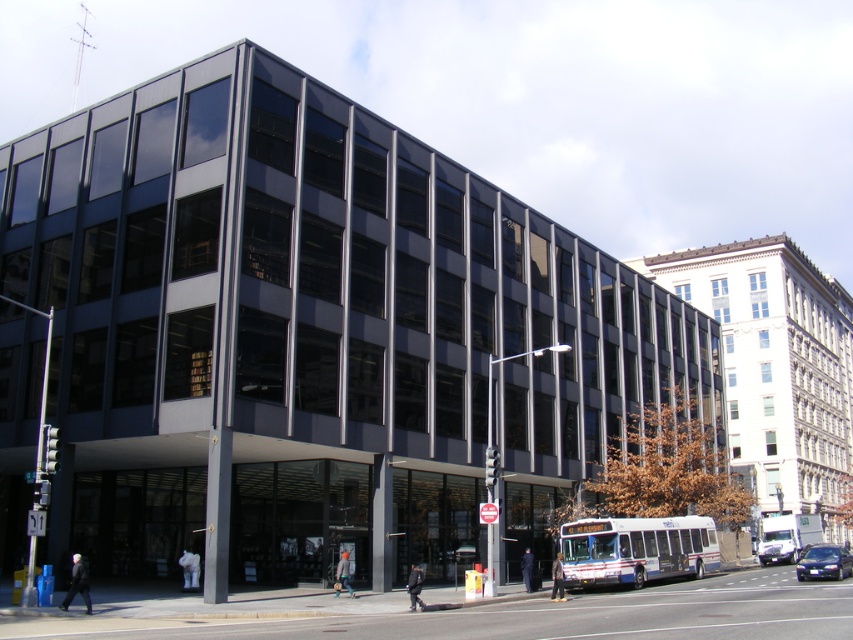
Can you confirm if white metallic bus at center is positioned above metallic blue sedan at center?

Yes, white metallic bus at center is above metallic blue sedan at center.

Locate an element on the screen. Image resolution: width=853 pixels, height=640 pixels. white metallic bus at center is located at coordinates (636, 548).

Does white matte bus at center have a greater width compared to metallic blue sedan at center?

Indeed, white matte bus at center has a greater width compared to metallic blue sedan at center.

Based on the photo, who is lower down, white matte bus at center or metallic blue sedan at center?

white matte bus at center is below.

Between point (798, 516) and point (807, 560), which one is positioned behind?

Positioned behind is point (798, 516).

Find the location of `white matte bus at center`. white matte bus at center is located at coordinates (787, 536).

Can you confirm if white metallic bus at center is smaller than white matte bus at center?

Yes, white metallic bus at center is smaller than white matte bus at center.

Can you confirm if white metallic bus at center is positioned to the left of white matte bus at center?

Correct, you'll find white metallic bus at center to the left of white matte bus at center.

Locate an element on the screen. This screenshot has height=640, width=853. white metallic bus at center is located at coordinates (636, 548).